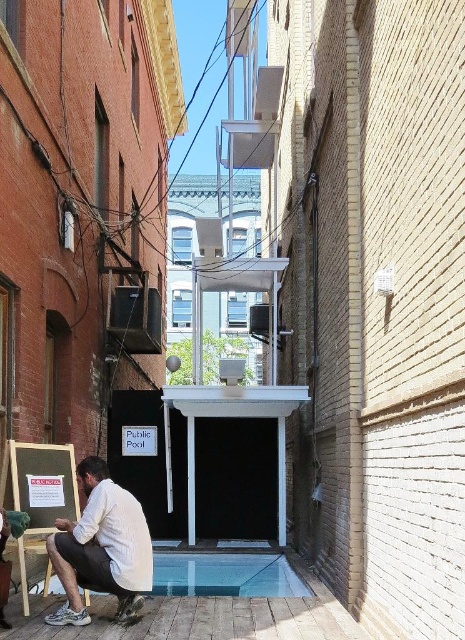
You are standing at the entrance of the alley and want to locate the transparent glass pool at lower center. According to the coordinates provided, where exactly is it positioned?

The transparent glass pool at lower center is located at point (225,573), which means it is positioned near the right side and slightly above the center of the alley.

You are standing at the entrance of the alley and want to reach the public pool entrance at the end. There are two points marked on the ground ahead of you. One is labeled as point [228,552] and the other as point [44,508]. Which point should you step on first to ensure you are moving towards the pool entrance?

You should step on point [44,508] first because point [228,552] is behind it, meaning point [44,508] is closer to your current position at the entrance.

You are standing at the entrance of the alley and want to reach the public pool entrance at the end. There is a white cotton shirt at lower center and a wooden easel at lower left in your path. Which object should you avoid stepping on to stay on the path towards the pool?

You should avoid stepping on the wooden easel at lower left because the white cotton shirt at lower center is to the right of it, indicating the path is to the right of the easel.